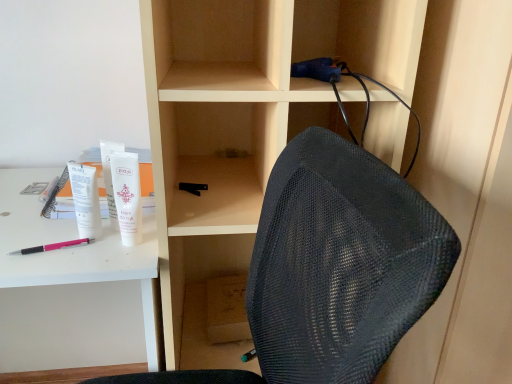
Question: Is blue fabric cable at upper center, the 4th stationery when ordered from bottom to top, to the left or to the right of pink plastic pen at lower left in the image?

Choices:
 (A) right
 (B) left

Answer: (A)

Question: From their relative heights in the image, would you say blue fabric cable at upper center, acting as the 4th stationery starting from the left, is taller or shorter than pink plastic pen at lower left?

Choices:
 (A) short
 (B) tall

Answer: (B)

Question: Considering the real-world distances, which object is farthest from the black plastic ruler at center, acting as the second stationery starting from the right?

Choices:
 (A) pink plastic pen at lower left
 (B) white matte tube at upper left, which is the second stationery in left-to-right order
 (C) white matte tube at upper left, the 4th stationery positioned from the right
 (D) white plastic desk at upper left
 (E) white matte tube at upper left

Answer: (D)

Question: Which is farther from the white matte tube at upper left, the 4th stationery positioned from the right?

Choices:
 (A) white matte tube at upper left, which is the second stationery in left-to-right order
 (B) blue fabric cable at upper center, the 4th stationery when ordered from bottom to top
 (C) matte wood cabinet at center
 (D) black plastic ruler at center, positioned as the 3th stationery in left-to-right order
 (E) pink plastic pen at lower left

Answer: (B)